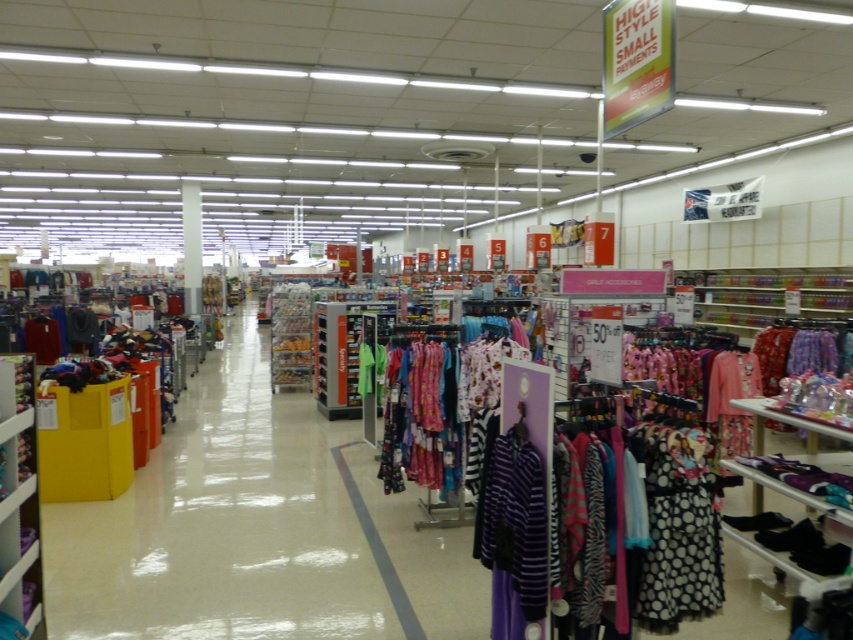
Consider the image. You are a store employee who needs to reach the purple striped shirt at lower center. The matte plastic clothing rack at center is blocking your path. Can you walk around it to access the shirt?

The matte plastic clothing rack at center is further to the viewer than the purple striped shirt at lower center, so you can walk around the rack to access the shirt.

You are a customer in the store and want to see the black dotted dress at lower right. Can you see it from your current position in front of the matte plastic clothing rack at center?

The black dotted dress at lower right is behind the matte plastic clothing rack at center, so it might be blocked from view unless you move around the rack.